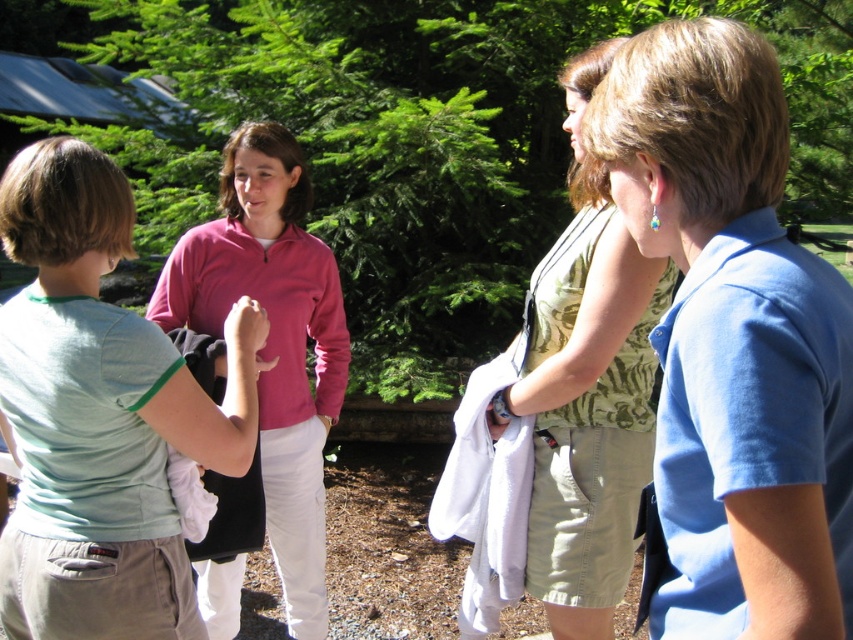
Between point (770, 634) and point (230, 300), which one is positioned behind?

The point (230, 300) is more distant.

How far apart are blue cotton shirt at upper right and pink zip-up sweater at center?

blue cotton shirt at upper right and pink zip-up sweater at center are 1.92 meters apart from each other.

At what (x,y) coordinates should I click in order to perform the action: click on blue cotton shirt at upper right. Please return your answer as a coordinate pair (x, y). Image resolution: width=853 pixels, height=640 pixels. Looking at the image, I should click on (733, 339).

Between light green t-shirt at left and green textured blouse at center, which one has less height?

light green t-shirt at left

Is light green t-shirt at left shorter than green textured blouse at center?

Correct, light green t-shirt at left is not as tall as green textured blouse at center.

You are a GUI agent. You are given a task and a screenshot of the screen. Output one action in this format:
    pyautogui.click(x=<x>, y=<y>)
    Task: Click on the light green t-shirt at left
    
    Given the screenshot: What is the action you would take?
    pyautogui.click(x=100, y=413)

Find the location of a particular element. The height and width of the screenshot is (640, 853). light green t-shirt at left is located at coordinates (100, 413).

Is point (546, 554) closer to viewer compared to point (286, 150)?

Yes, it is in front of point (286, 150).

At what (x,y) coordinates should I click in order to perform the action: click on green textured blouse at center. Please return your answer as a coordinate pair (x, y). This screenshot has height=640, width=853. Looking at the image, I should click on [587, 390].

Describe the element at coordinates (587, 390) in the screenshot. I see `green textured blouse at center` at that location.

Where is `green textured blouse at center`? This screenshot has width=853, height=640. green textured blouse at center is located at coordinates (587, 390).